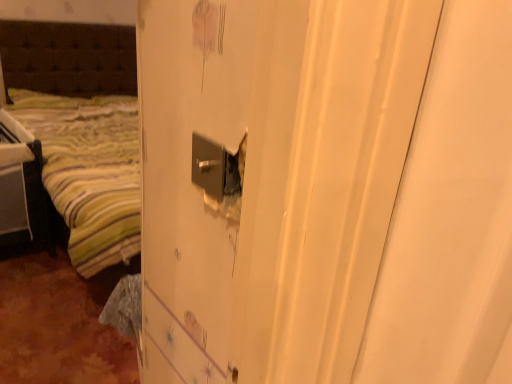
At what (x,y) coordinates should I click in order to perform the action: click on satin silver lock at center. Please return your answer as a coordinate pair (x, y). The width and height of the screenshot is (512, 384). Looking at the image, I should click on (217, 167).

Describe the element at coordinates (217, 167) in the screenshot. The width and height of the screenshot is (512, 384). I see `satin silver lock at center` at that location.

This screenshot has width=512, height=384. What are the coordinates of `satin silver lock at center` in the screenshot? It's located at 217,167.